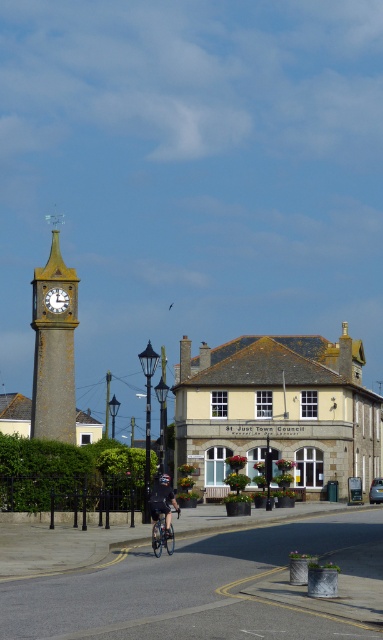
Does black matte cycling suit at center appear on the right side of blue metallic bicycle at center?

No, black matte cycling suit at center is not to the right of blue metallic bicycle at center.

Is point (160, 477) more distant than point (152, 532)?

Yes, point (160, 477) is farther from viewer.

Identify the location of black matte cycling suit at center. (163, 500).

Can you confirm if blue metallic bicycle at center is positioned to the right of matte gold clock at upper left?

Correct, you'll find blue metallic bicycle at center to the right of matte gold clock at upper left.

Between point (168, 531) and point (54, 292), which one is positioned in front?

Point (168, 531) is more forward.

This screenshot has width=383, height=640. I want to click on blue metallic bicycle at center, so click(162, 534).

Does black matte cycling suit at center have a smaller size compared to matte gold clock at upper left?

Actually, black matte cycling suit at center might be larger than matte gold clock at upper left.

Is black matte cycling suit at center positioned before matte gold clock at upper left?

Yes, black matte cycling suit at center is closer to the viewer.

Describe the element at coordinates (163, 500) in the screenshot. I see `black matte cycling suit at center` at that location.

You are a GUI agent. You are given a task and a screenshot of the screen. Output one action in this format:
    pyautogui.click(x=<x>, y=<y>)
    Task: Click on the black matte cycling suit at center
    
    Given the screenshot: What is the action you would take?
    pyautogui.click(x=163, y=500)